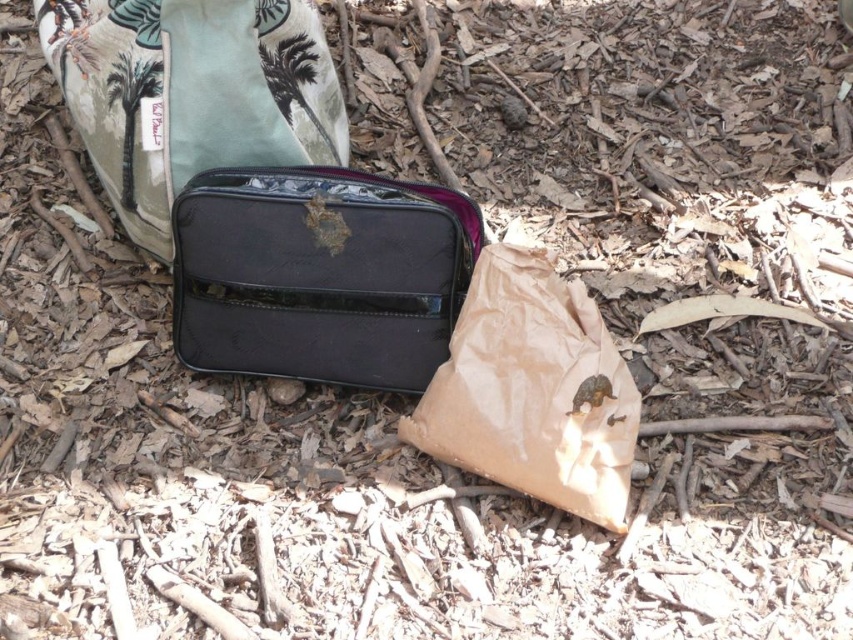
Question: Among these points, which one is farthest from the camera?

Choices:
 (A) (566, 310)
 (B) (425, 272)
 (C) (111, 122)

Answer: (C)

Question: Among these points, which one is farthest from the camera?

Choices:
 (A) (242, 112)
 (B) (624, 456)

Answer: (A)

Question: Is glossy black pouch at center above brown paper bag at center?

Choices:
 (A) no
 (B) yes

Answer: (B)

Question: Which point appears closest to the camera in this image?

Choices:
 (A) (265, 342)
 (B) (614, 525)

Answer: (B)

Question: Does glossy black bag at center have a greater width compared to brown paper bag at center?

Choices:
 (A) no
 (B) yes

Answer: (B)

Question: Is glossy black bag at center to the left of glossy black pouch at center from the viewer's perspective?

Choices:
 (A) no
 (B) yes

Answer: (A)